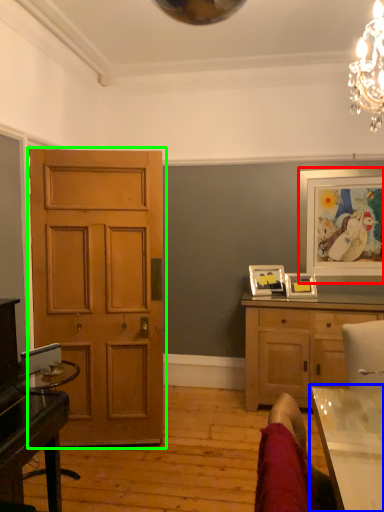
Question: Which is nearer to the picture frame (highlighted by a red box)? table (highlighted by a blue box) or door (highlighted by a green box).

Choices:
 (A) table
 (B) door

Answer: (B)